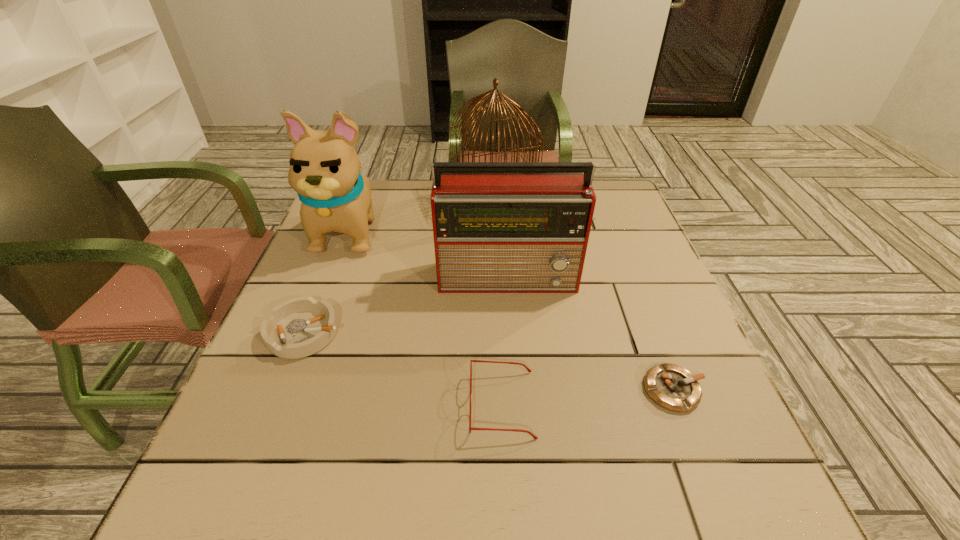
Image resolution: width=960 pixels, height=540 pixels. Identify the location of birdcage. (477, 101).

Where is `puppy`? This screenshot has width=960, height=540. puppy is located at coordinates point(324,169).

In order to click on radio receiver in this screenshot , I will do `click(499, 227)`.

Where is `spectacles`? This screenshot has height=540, width=960. spectacles is located at coordinates (516, 430).

Find the location of `the left ashtray`. the left ashtray is located at coordinates (299, 327).

This screenshot has width=960, height=540. What are the coordinates of `the taller ashtray` in the screenshot? It's located at (299, 327).

Locate an element on the screen. the rightmost object is located at coordinates (672, 387).

Where is `the nearer ashtray`? The image size is (960, 540). the nearer ashtray is located at coordinates (672, 387).

I want to click on vacant region located 0.320m on the left of the birdcage, so click(x=343, y=199).

Where is `free space located on the face of the puppy`? This screenshot has width=960, height=540. free space located on the face of the puppy is located at coordinates (311, 329).